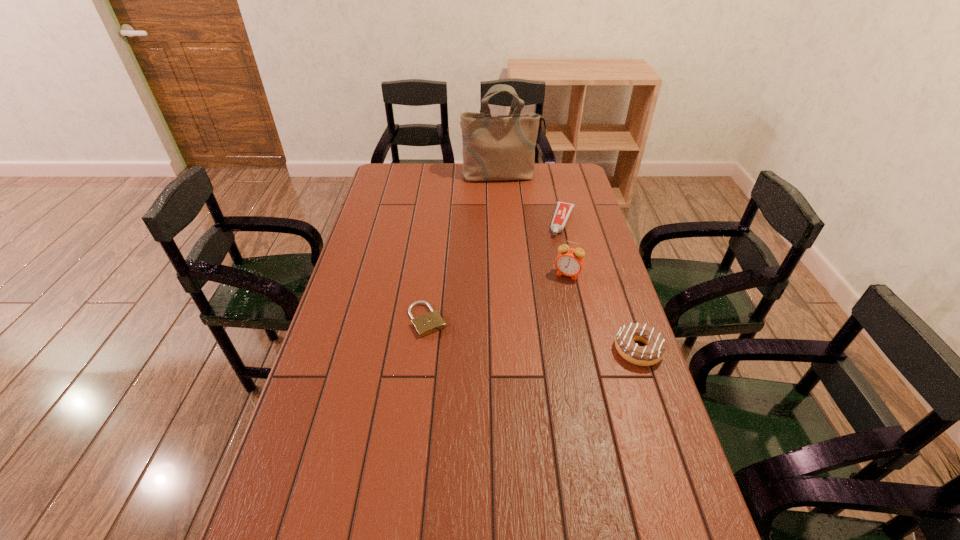
At what (x,y) coordinates should I click in order to perform the action: click on vacant point that satisfies the following two spatial constraints: 1. on the front side of the rightmost object; 2. on the right side of the fourth shortest object. Please return your answer as a coordinate pair (x, y). Looking at the image, I should click on (585, 350).